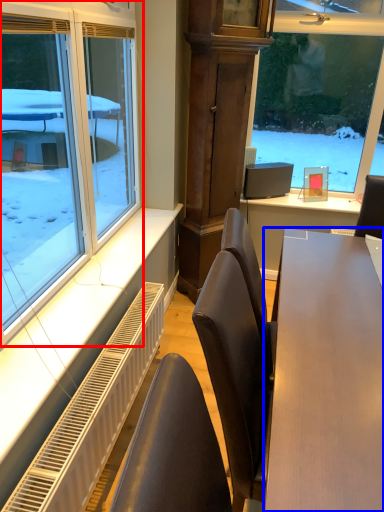
Question: Which object is closer to the camera taking this photo, window (highlighted by a red box) or table (highlighted by a blue box)?

Choices:
 (A) window
 (B) table

Answer: (B)